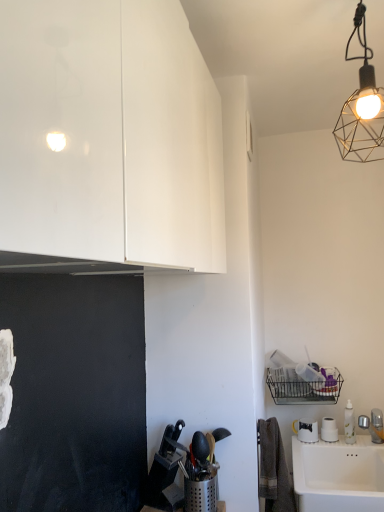
Question: From a real-world perspective, is glossy white cabinet at upper left positioned over metallic wire mesh at upper right based on gravity?

Choices:
 (A) yes
 (B) no

Answer: (B)

Question: Does glossy white cabinet at upper left come in front of metallic wire mesh at upper right?

Choices:
 (A) yes
 (B) no

Answer: (A)

Question: From a real-world perspective, is glossy white cabinet at upper left located beneath metallic wire mesh at upper right?

Choices:
 (A) yes
 (B) no

Answer: (A)

Question: Are glossy white cabinet at upper left and metallic wire mesh at upper right far apart?

Choices:
 (A) no
 (B) yes

Answer: (A)

Question: Is glossy white cabinet at upper left thinner than metallic wire mesh at upper right?

Choices:
 (A) yes
 (B) no

Answer: (B)

Question: Based on their positions, is metallic wire mesh at upper right located to the left or right of white ceramic sink at lower right?

Choices:
 (A) left
 (B) right

Answer: (A)

Question: In terms of width, does metallic wire mesh at upper right look wider or thinner when compared to white ceramic sink at lower right?

Choices:
 (A) wide
 (B) thin

Answer: (B)

Question: Considering their positions, is metallic wire mesh at upper right located in front of or behind white ceramic sink at lower right?

Choices:
 (A) behind
 (B) front

Answer: (B)

Question: Is metallic wire mesh at upper right situated inside white ceramic sink at lower right or outside?

Choices:
 (A) inside
 (B) outside

Answer: (B)

Question: Considering the positions of glossy white cabinet at upper left and metallic wire mesh at upper right in the image, is glossy white cabinet at upper left bigger or smaller than metallic wire mesh at upper right?

Choices:
 (A) big
 (B) small

Answer: (A)

Question: Considering the positions of glossy white cabinet at upper left and metallic wire mesh at upper right in the image, is glossy white cabinet at upper left taller or shorter than metallic wire mesh at upper right?

Choices:
 (A) short
 (B) tall

Answer: (B)

Question: Is glossy white cabinet at upper left situated inside metallic wire mesh at upper right or outside?

Choices:
 (A) inside
 (B) outside

Answer: (B)

Question: Looking at their shapes, would you say glossy white cabinet at upper left is wider or thinner than metallic wire mesh at upper right?

Choices:
 (A) thin
 (B) wide

Answer: (B)

Question: Is white ceramic sink at lower right taller or shorter than glossy white cabinet at upper left?

Choices:
 (A) tall
 (B) short

Answer: (B)

Question: From the image's perspective, is white ceramic sink at lower right above or below glossy white cabinet at upper left?

Choices:
 (A) above
 (B) below

Answer: (B)